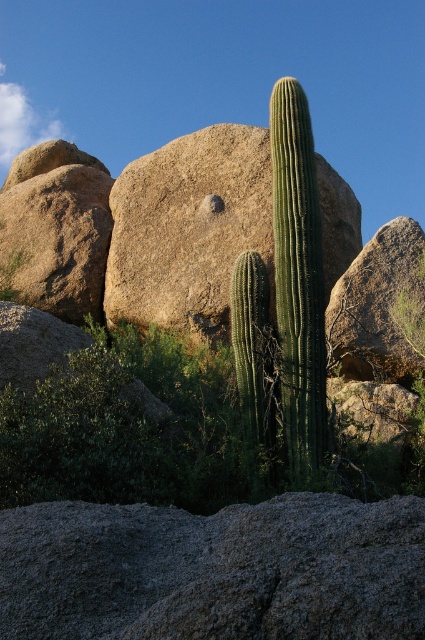
Question: Which of these objects is positioned closest to the green spiny cactus at center?

Choices:
 (A) rough textured rock at left
 (B) gray rough rock at lower center

Answer: (B)

Question: Which of the following is the closest to the observer?

Choices:
 (A) (297, 184)
 (B) (328, 547)
 (C) (82, 256)
 (D) (116, 212)

Answer: (B)

Question: Is gray rough rock at lower center below green spiny cactus at center?

Choices:
 (A) no
 (B) yes

Answer: (B)

Question: Does green spiny cactus at center appear on the left side of rough textured rock at left?

Choices:
 (A) yes
 (B) no

Answer: (B)

Question: Observing the image, what is the correct spatial positioning of green spiny cactus at center in reference to rough textured rock at left?

Choices:
 (A) left
 (B) right

Answer: (B)

Question: Which of the following is the farthest from the observer?

Choices:
 (A) rough textured rock at left
 (B) gray rough rock at lower center
 (C) green spiny cactus at center
 (D) smooth beige rock at center

Answer: (A)